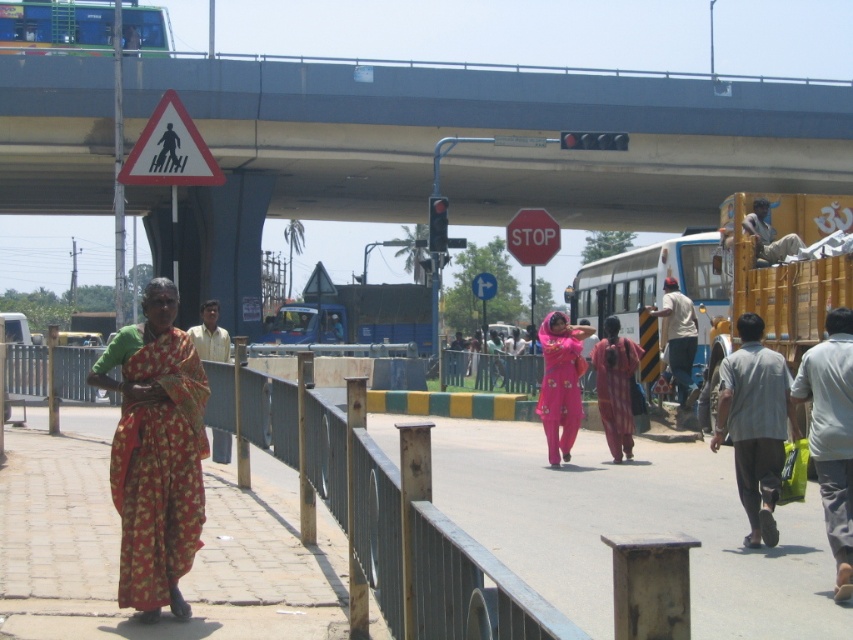
Question: Does white matte school bus at center appear over white triangular pedestrian sign at upper left?

Choices:
 (A) yes
 (B) no

Answer: (B)

Question: Is white matte school bus at center bigger than pink fabric saree at center?

Choices:
 (A) no
 (B) yes

Answer: (B)

Question: Which object is positioned farthest from the light beige shirt at center?

Choices:
 (A) gray cotton shirt at right
 (B) white matte school bus at center

Answer: (A)

Question: Among these objects, which one is farthest from the camera?

Choices:
 (A) white triangular pedestrian sign at upper left
 (B) concrete bridge at upper center
 (C) light beige shirt at center

Answer: (B)

Question: Does concrete bridge at upper center appear on the left side of red matte stop sign at center?

Choices:
 (A) no
 (B) yes

Answer: (B)

Question: Estimate the real-world distances between objects in this image. Which object is closer to the light gray cotton shirt at lower right?

Choices:
 (A) blue plastic arrow at center
 (B) concrete bridge at upper center

Answer: (A)